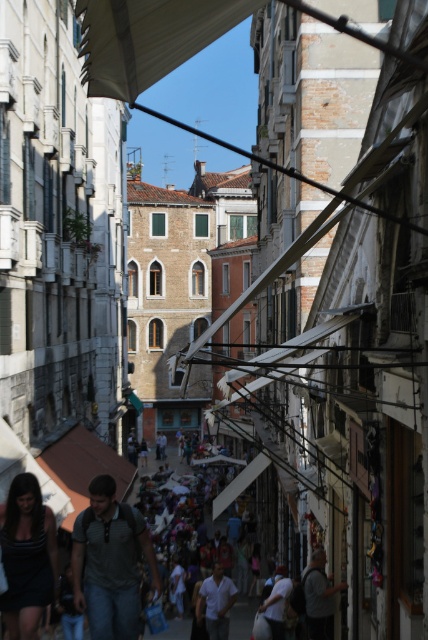
Does point (39, 548) come behind point (231, 582)?

No.

How much distance is there between dark gray dress at lower left and white matte shirt at center?

dark gray dress at lower left and white matte shirt at center are 25.77 meters apart.

Is point (26, 588) positioned after point (216, 596)?

No, (26, 588) is in front of (216, 596).

Locate an element on the screen. dark gray dress at lower left is located at coordinates (26, 556).

Can you confirm if white fabric canopy at upper center is taller than denim jeans at center?

No, white fabric canopy at upper center is not taller than denim jeans at center.

Can you confirm if white fabric canopy at upper center is positioned above denim jeans at center?

Indeed, white fabric canopy at upper center is positioned over denim jeans at center.

The image size is (428, 640). What are the coordinates of `white fabric canopy at upper center` in the screenshot? It's located at coord(148,38).

Can you confirm if white fabric canopy at upper center is shorter than dark gray fabric at lower center?

No, white fabric canopy at upper center is not shorter than dark gray fabric at lower center.

Is white fabric canopy at upper center further to the viewer compared to dark gray fabric at lower center?

No, it is in front of dark gray fabric at lower center.

Describe the element at coordinates (148, 38) in the screenshot. This screenshot has width=428, height=640. I see `white fabric canopy at upper center` at that location.

Where is `white fabric canopy at upper center`? This screenshot has width=428, height=640. white fabric canopy at upper center is located at coordinates (148, 38).